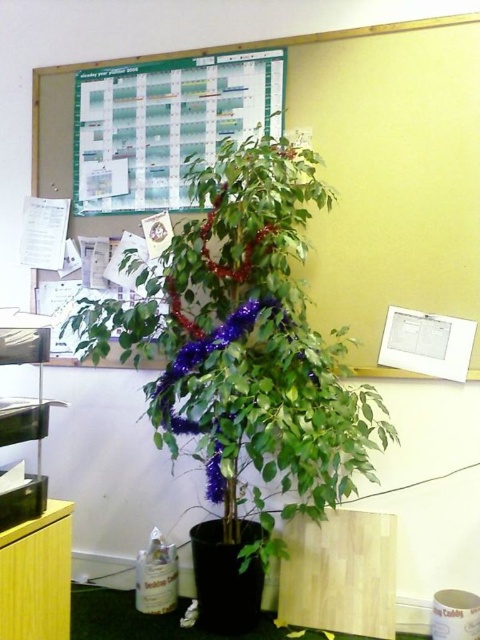
You are organizing a virtual tour of this office space. When describing the central area, you need to mention both the green glossy plant at center and the green paper at upper center. Which object is closer to the viewer?

The green glossy plant at center is closer to the viewer than the green paper at upper center because it is in front of it.

You are organizing a meeting in the office and need to check the schedule. You see the green matte bulletin board at upper center and the green paper at upper center. Which one is more to the left?

The green matte bulletin board at upper center is positioned on the left side of the green paper at upper center, so it is more to the left.